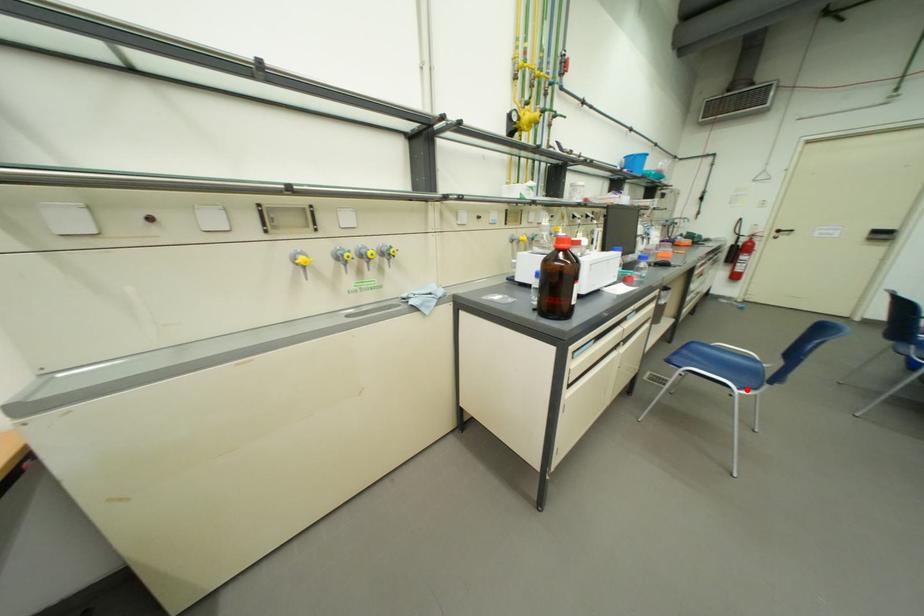
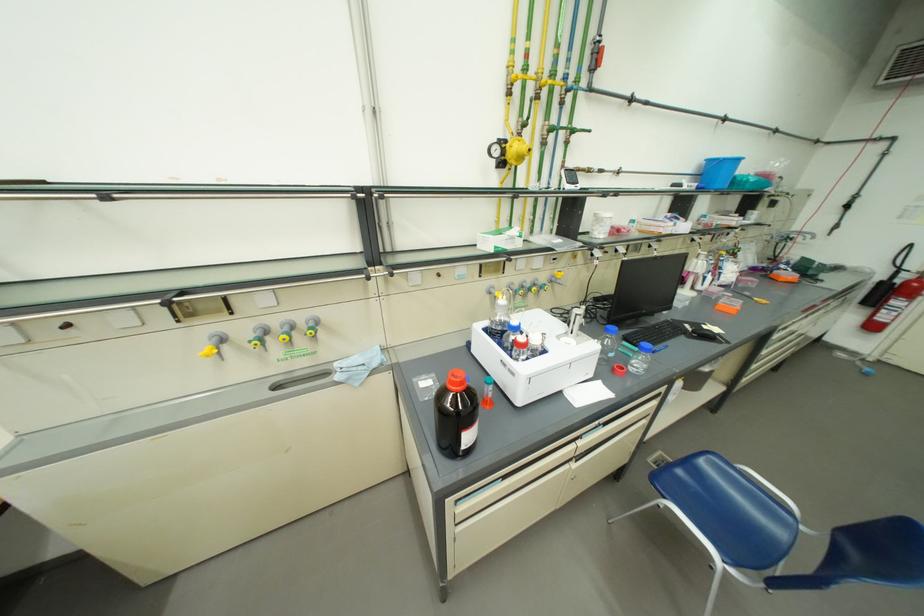
Where in the second image is the point corresponding to the highlighted location from the first image?

(734, 564)